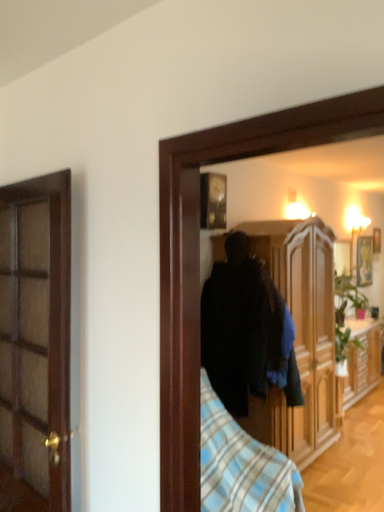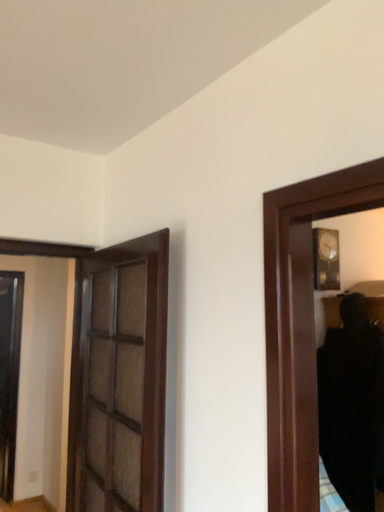
Question: Which way did the camera rotate in the video?

Choices:
 (A) rotated upward
 (B) rotated downward

Answer: (A)